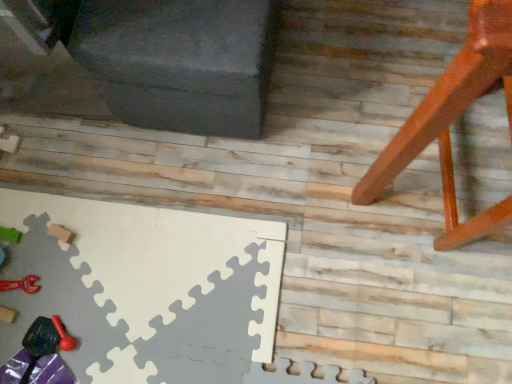
Question: Is metallic red wrench at lower left a part of matte orange wood chair at right?

Choices:
 (A) yes
 (B) no

Answer: (B)

Question: Can you confirm if matte orange wood chair at right is positioned to the right of metallic red wrench at lower left?

Choices:
 (A) yes
 (B) no

Answer: (A)

Question: Is matte orange wood chair at right located outside metallic red wrench at lower left?

Choices:
 (A) yes
 (B) no

Answer: (A)

Question: From a real-world perspective, does matte orange wood chair at right stand above metallic red wrench at lower left?

Choices:
 (A) no
 (B) yes

Answer: (B)

Question: Is matte orange wood chair at right behind metallic red wrench at lower left?

Choices:
 (A) yes
 (B) no

Answer: (B)

Question: Does matte orange wood chair at right have a greater height compared to metallic red wrench at lower left?

Choices:
 (A) yes
 (B) no

Answer: (A)

Question: From the image's perspective, would you say metallic red wrench at lower left is positioned over matte orange wood chair at right?

Choices:
 (A) yes
 (B) no

Answer: (B)

Question: Is metallic red wrench at lower left smaller than matte orange wood chair at right?

Choices:
 (A) no
 (B) yes

Answer: (B)

Question: Is matte orange wood chair at right a part of metallic red wrench at lower left?

Choices:
 (A) yes
 (B) no

Answer: (B)

Question: From the image's perspective, is metallic red wrench at lower left under matte orange wood chair at right?

Choices:
 (A) yes
 (B) no

Answer: (A)

Question: Is metallic red wrench at lower left not inside matte orange wood chair at right?

Choices:
 (A) no
 (B) yes

Answer: (B)

Question: Is metallic red wrench at lower left bigger than matte orange wood chair at right?

Choices:
 (A) no
 (B) yes

Answer: (A)

Question: Is metallic red wrench at lower left wider or thinner than matte orange wood chair at right?

Choices:
 (A) thin
 (B) wide

Answer: (A)